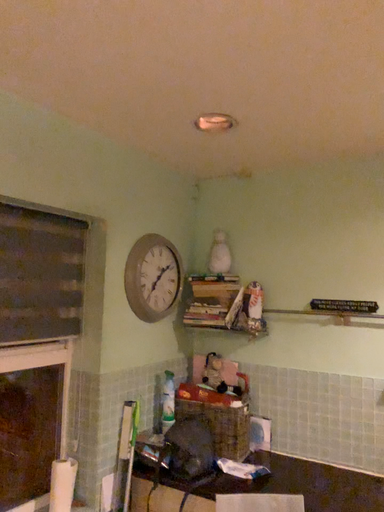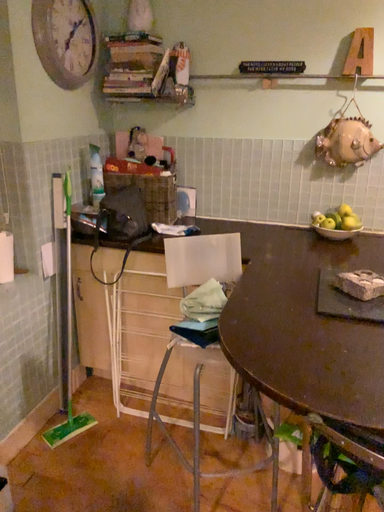
Question: Which way did the camera rotate in the video?

Choices:
 (A) rotated left
 (B) rotated right

Answer: (B)